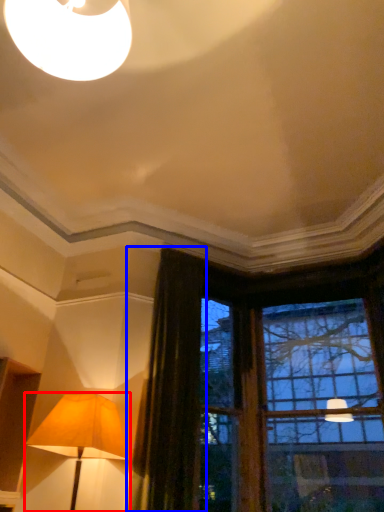
Question: Which point is closer to the camera, lamp (highlighted by a red box) or curtain (highlighted by a blue box)?

Choices:
 (A) lamp
 (B) curtain

Answer: (A)